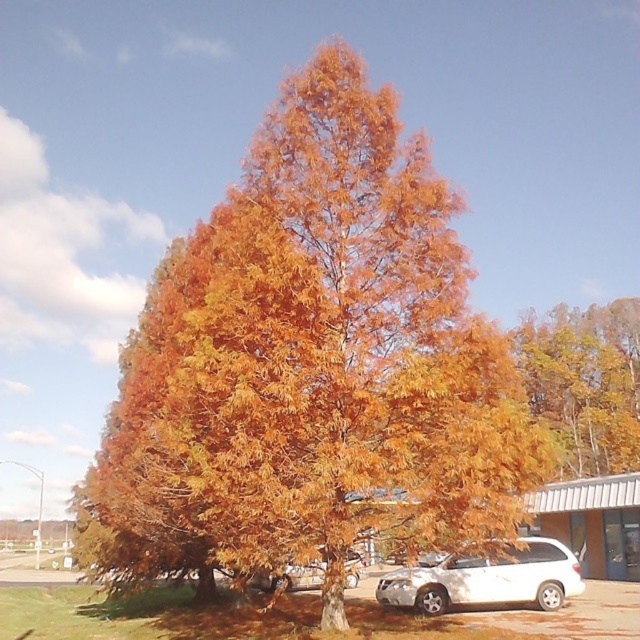
Question: Which point is closer to the camera?

Choices:
 (A) white matte van at lower right
 (B) orange leafy tree at center
 (C) orange matte tree at upper right

Answer: (B)

Question: In this image, where is orange leafy tree at center located relative to white matte van at lower right?

Choices:
 (A) below
 (B) above

Answer: (B)

Question: Which of the following is the closest to the observer?

Choices:
 (A) orange matte tree at upper right
 (B) satin silver car at center
 (C) orange leafy tree at center
 (D) white matte van at lower right

Answer: (C)

Question: Is orange leafy tree at center wider than orange matte tree at upper right?

Choices:
 (A) no
 (B) yes

Answer: (B)

Question: Among these points, which one is farthest from the camera?

Choices:
 (A) (404, 576)
 (B) (598, 420)
 (C) (221, 472)
 (D) (275, 573)

Answer: (B)

Question: Can you confirm if orange leafy tree at center is smaller than satin silver car at center?

Choices:
 (A) yes
 (B) no

Answer: (B)